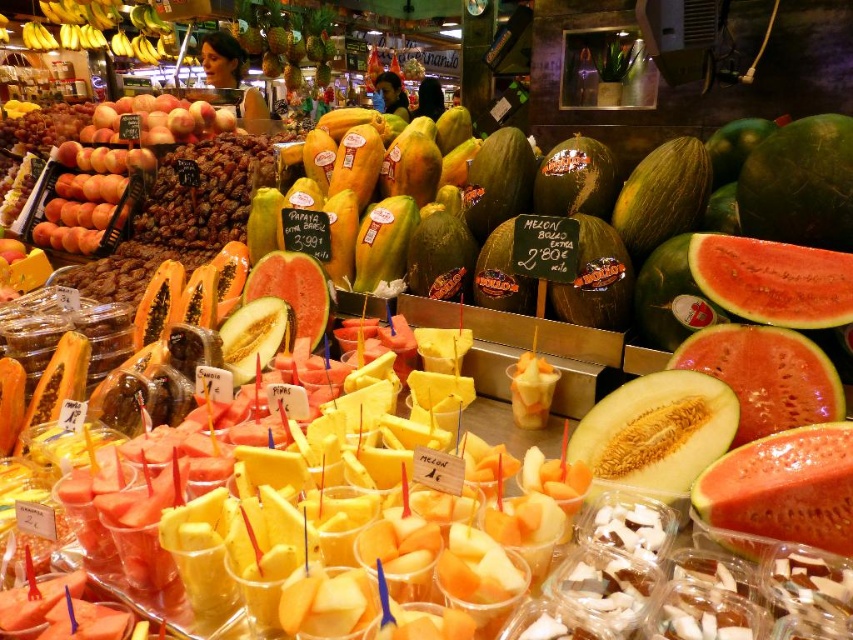
Question: Can you confirm if juicy red watermelon at center is positioned below watermelon at center?

Choices:
 (A) no
 (B) yes

Answer: (B)

Question: Based on their relative distances, which object is farther from the juicy red watermelon at center?

Choices:
 (A) red textured watermelon at center right
 (B) watermelon at center

Answer: (B)

Question: Which point is closer to the camera taking this photo?

Choices:
 (A) click(669, 364)
 (B) click(844, 426)
 (C) click(138, 145)

Answer: (B)

Question: Does juicy red watermelon at center have a greater width compared to ripe red watermelon at center?

Choices:
 (A) yes
 (B) no

Answer: (A)

Question: From the image, what is the correct spatial relationship of matte orange peaches at center in relation to ripe red watermelon at center?

Choices:
 (A) above
 (B) below

Answer: (A)

Question: Which object is positioned farthest from the watermelon at center?

Choices:
 (A) ripe red watermelon at center
 (B) matte orange peaches at center
 (C) red textured watermelon at center right
 (D) juicy red watermelon at center

Answer: (B)